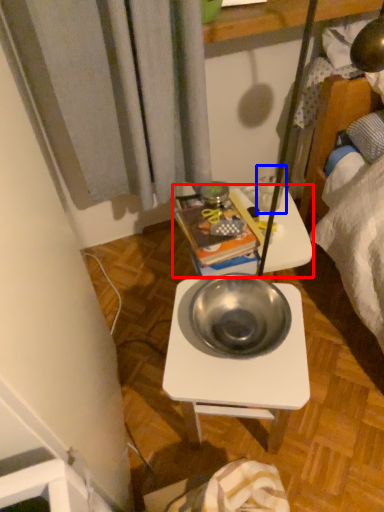
Question: Which object appears farthest to the camera in this image, table (highlighted by a red box) or coffee cup (highlighted by a blue box)?

Choices:
 (A) table
 (B) coffee cup

Answer: (B)